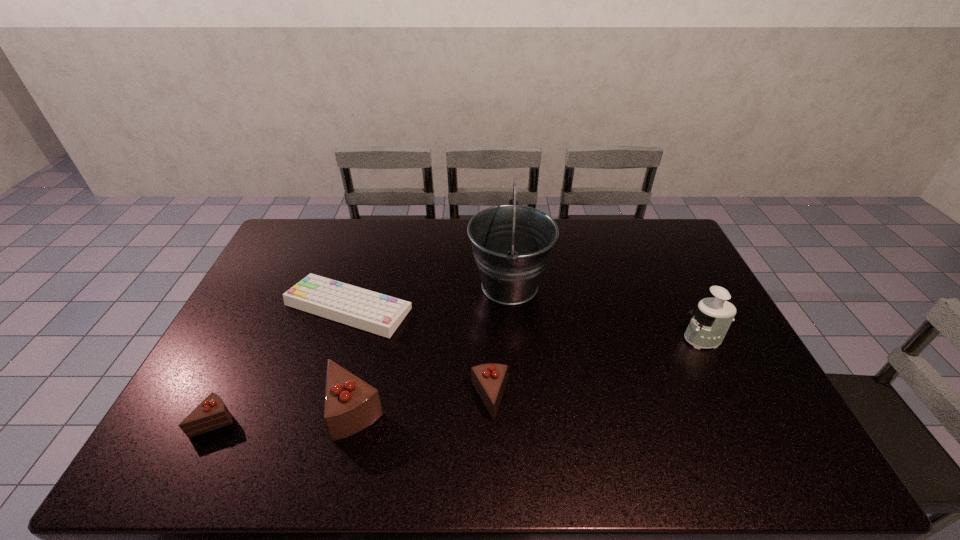
All chocolate cakes are currently evenly spaced. To continue this pattern, where would you add another chocolate cake on the right? Please point out a vacant spot. Please provide its 2D coordinates. Your answer should be formatted as a tuple, i.e. [(x, y)], where the tuple contains the x and y coordinates of a point satisfying the conditions above.

[(619, 389)]